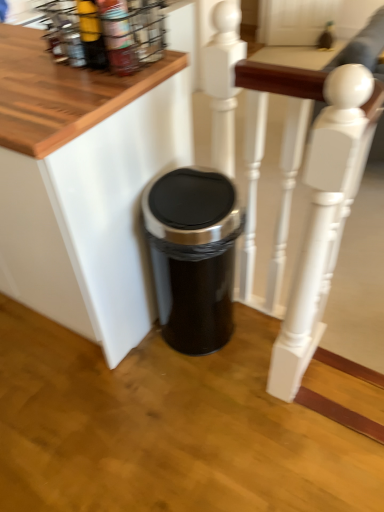
What do you see at coordinates (322, 225) in the screenshot? Image resolution: width=384 pixels, height=512 pixels. I see `white painted wood at center` at bounding box center [322, 225].

Measure the distance between matte yellow bottle at upper left and camera.

matte yellow bottle at upper left is 3.76 feet from camera.

You are a GUI agent. You are given a task and a screenshot of the screen. Output one action in this format:
    pyautogui.click(x=<x>, y=<y>)
    Task: Click on the metallic wire spice rack at upper left
    
    Given the screenshot: What is the action you would take?
    pyautogui.click(x=106, y=33)

Measure the distance between point (220, 239) and camera.

Point (220, 239) is 4.08 feet away from camera.

This screenshot has width=384, height=512. Find the location of `black plastic trash can at lower center`. black plastic trash can at lower center is located at coordinates (83, 185).

The height and width of the screenshot is (512, 384). What do you see at coordinates (83, 185) in the screenshot?
I see `black plastic trash can at lower center` at bounding box center [83, 185].

Locate an element on the screen. white painted wood at center is located at coordinates (322, 225).

Is black metallic trash can at center next to white painted wood at center?

No, black metallic trash can at center is not with white painted wood at center.

Looking at their sizes, would you say black metallic trash can at center is wider or thinner than white painted wood at center?

black metallic trash can at center is wider than white painted wood at center.

From a real-world perspective, is black metallic trash can at center located higher than white painted wood at center?

No, from a real-world perspective, black metallic trash can at center is not over white painted wood at center

From the image's perspective, is black metallic trash can at center positioned above or below white painted wood at center?

From the image's perspective, black metallic trash can at center appears below white painted wood at center.

From the image's perspective, which is above, metallic wire spice rack at upper left or matte yellow bottle at upper left?

matte yellow bottle at upper left appears higher in the image.

Is matte yellow bottle at upper left at the back of metallic wire spice rack at upper left?

No, metallic wire spice rack at upper left's orientation is not away from matte yellow bottle at upper left.

Consider the image. Looking at their sizes, would you say metallic wire spice rack at upper left is wider or thinner than matte yellow bottle at upper left?

Clearly, metallic wire spice rack at upper left has more width compared to matte yellow bottle at upper left.

Is metallic wire spice rack at upper left inside or outside of matte yellow bottle at upper left?

metallic wire spice rack at upper left lies outside matte yellow bottle at upper left.

How much distance is there between black metallic trash can at center and matte yellow bottle at upper left?

black metallic trash can at center is 25.28 inches from matte yellow bottle at upper left.

From the image's perspective, which one is positioned higher, black metallic trash can at center or matte yellow bottle at upper left?

matte yellow bottle at upper left.

Does black metallic trash can at center lie behind matte yellow bottle at upper left?

Yes, it is behind matte yellow bottle at upper left.

Is black metallic trash can at center positioned with its back to matte yellow bottle at upper left?

No.

Is point (136, 249) positioned before point (227, 282)?

Yes, it is in front of point (227, 282).

Does black plastic trash can at lower center appear on the right side of black metallic trash can at center?

Incorrect, black plastic trash can at lower center is not on the right side of black metallic trash can at center.

I want to click on furniture above the black metallic trash can at center (from the image's perspective), so click(83, 185).

Which is behind, black plastic trash can at lower center or black metallic trash can at center?

black metallic trash can at center is more distant.

Is white painted wood at center shorter than black metallic trash can at center?

No.

Is white painted wood at center in front of black metallic trash can at center?

Yes, it is in front of black metallic trash can at center.

Looking at the image, does white painted wood at center seem bigger or smaller compared to black metallic trash can at center?

white painted wood at center is bigger than black metallic trash can at center.

From the picture: Can you confirm if white painted wood at center is positioned to the left of black metallic trash can at center?

In fact, white painted wood at center is to the right of black metallic trash can at center.

Relative to black metallic trash can at center, is matte yellow bottle at upper left in front or behind?

In the image, matte yellow bottle at upper left appears in front of black metallic trash can at center.

Find the location of a particular element. Image resolution: width=384 pixels, height=512 pixels. bottle in front of the black metallic trash can at center is located at coordinates (91, 35).

Does matte yellow bottle at upper left contain black metallic trash can at center?

No, black metallic trash can at center is located outside of matte yellow bottle at upper left.

How far apart are metallic wire spice rack at upper left and black metallic trash can at center?

The distance of metallic wire spice rack at upper left from black metallic trash can at center is 21.16 inches.

Is metallic wire spice rack at upper left in contact with black metallic trash can at center?

No, metallic wire spice rack at upper left is not with black metallic trash can at center.

Locate an element on the screen. This screenshot has width=384, height=512. spice rack above the black metallic trash can at center (from a real-world perspective) is located at coordinates (106, 33).

From a real-world perspective, which is physically above, metallic wire spice rack at upper left or black metallic trash can at center?

metallic wire spice rack at upper left is physically above.

I want to click on rail on the right side of black metallic trash can at center, so click(x=322, y=225).

The image size is (384, 512). I want to click on bottle in front of the metallic wire spice rack at upper left, so click(x=91, y=35).

Considering their positions, is matte yellow bottle at upper left positioned further to white painted wood at center than black metallic trash can at center?

matte yellow bottle at upper left.

Which object lies nearer to the anchor point metallic wire spice rack at upper left, white painted wood at center or black metallic trash can at center?

white painted wood at center.

When comparing their distances from matte yellow bottle at upper left, does black metallic trash can at center or white painted wood at center seem closer?

black metallic trash can at center lies closer to matte yellow bottle at upper left than the other object.

Looking at the image, which one is located further to black plastic trash can at lower center, matte yellow bottle at upper left or metallic wire spice rack at upper left?

matte yellow bottle at upper left is positioned further to the anchor black plastic trash can at lower center.

From the picture: Which object lies nearer to the anchor point matte yellow bottle at upper left, white painted wood at center or black metallic trash can at center?

black metallic trash can at center.

Estimate the real-world distances between objects in this image. Which object is closer to black plastic trash can at lower center, black metallic trash can at center or matte yellow bottle at upper left?

Based on the image, black metallic trash can at center appears to be nearer to black plastic trash can at lower center.

Which object lies nearer to the anchor point black plastic trash can at lower center, metallic wire spice rack at upper left or white painted wood at center?

metallic wire spice rack at upper left lies closer to black plastic trash can at lower center than the other object.

When comparing their distances from metallic wire spice rack at upper left, does black metallic trash can at center or white painted wood at center seem further?

black metallic trash can at center is positioned further to the anchor metallic wire spice rack at upper left.

Where is `bottle between black plastic trash can at lower center and metallic wire spice rack at upper left from left to right`? bottle between black plastic trash can at lower center and metallic wire spice rack at upper left from left to right is located at coordinates (91, 35).

Locate an element on the screen. The width and height of the screenshot is (384, 512). bottle between black plastic trash can at lower center and black metallic trash can at center is located at coordinates (91, 35).

At what (x,y) coordinates should I click in order to perform the action: click on spice rack between matte yellow bottle at upper left and black metallic trash can at center in the vertical direction. Please return your answer as a coordinate pair (x, y). The image size is (384, 512). Looking at the image, I should click on (106, 33).

Locate an element on the screen. spice rack located between black plastic trash can at lower center and white painted wood at center in the left-right direction is located at coordinates pos(106,33).